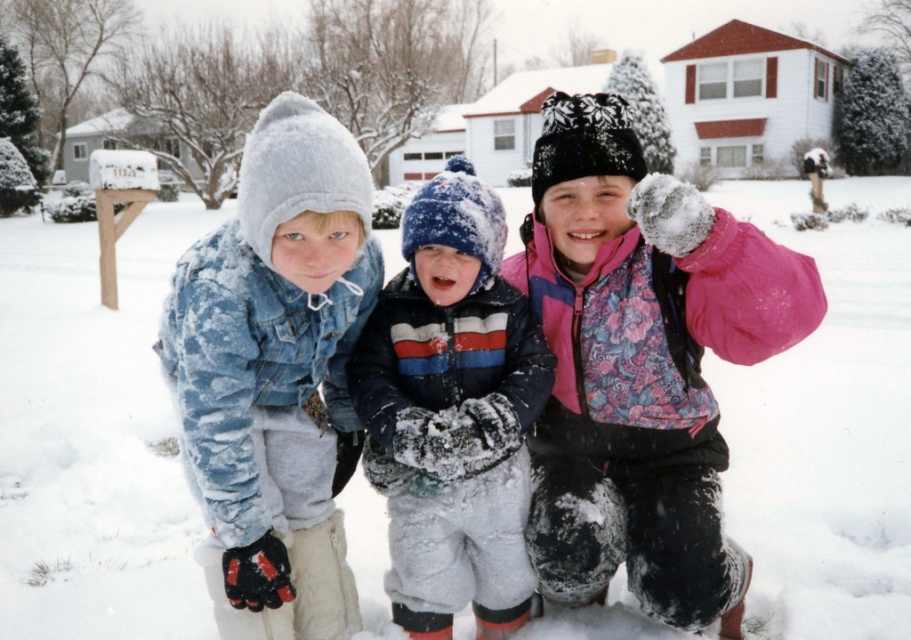
Can you confirm if pink fleece jacket at center is wider than fuzzy denim jacket at center?

Correct, the width of pink fleece jacket at center exceeds that of fuzzy denim jacket at center.

What do you see at coordinates (640, 365) in the screenshot?
I see `pink fleece jacket at center` at bounding box center [640, 365].

Is point (604, 97) farther from camera compared to point (253, 228)?

That is True.

In order to click on pink fleece jacket at center in this screenshot , I will do `click(640, 365)`.

Does pink fleece jacket at center have a larger size compared to striped fleece jacket at center?

Indeed, pink fleece jacket at center has a larger size compared to striped fleece jacket at center.

Based on the photo, which is above, pink fleece jacket at center or striped fleece jacket at center?

Positioned higher is pink fleece jacket at center.

This screenshot has width=911, height=640. Describe the element at coordinates (640, 365) in the screenshot. I see `pink fleece jacket at center` at that location.

Locate an element on the screen. pink fleece jacket at center is located at coordinates tap(640, 365).

Is point (244, 230) farther from camera compared to point (494, 481)?

No.

The width and height of the screenshot is (911, 640). Describe the element at coordinates (275, 374) in the screenshot. I see `fuzzy denim jacket at center` at that location.

Locate an element on the screen. Image resolution: width=911 pixels, height=640 pixels. fuzzy denim jacket at center is located at coordinates (275, 374).